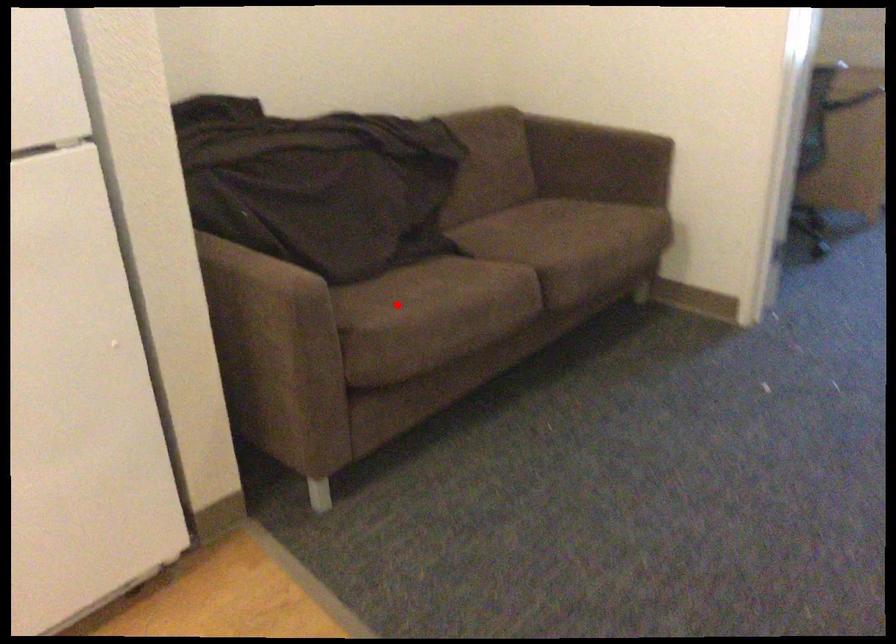
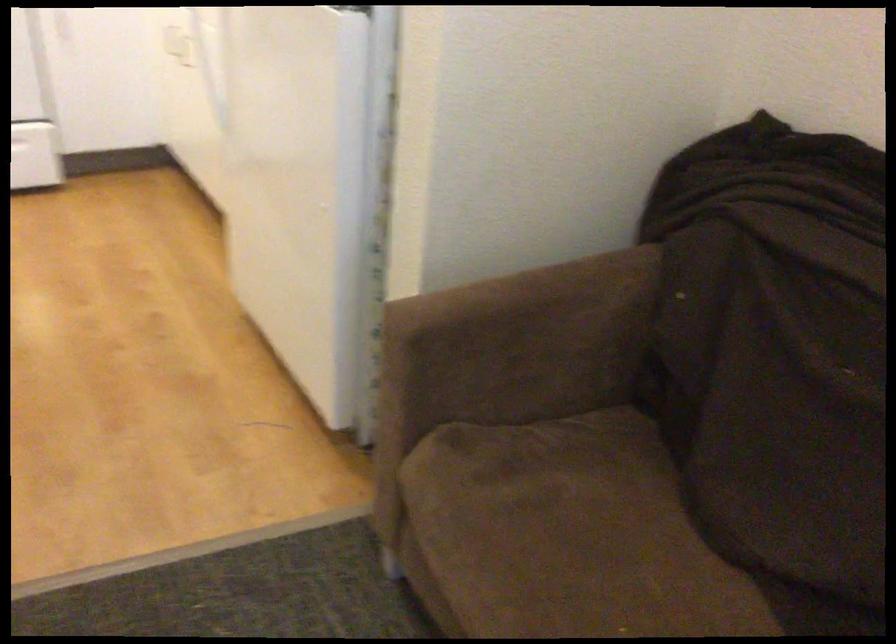
Where in the second image is the point corresponding to the highlighted location from the first image?

(563, 542)